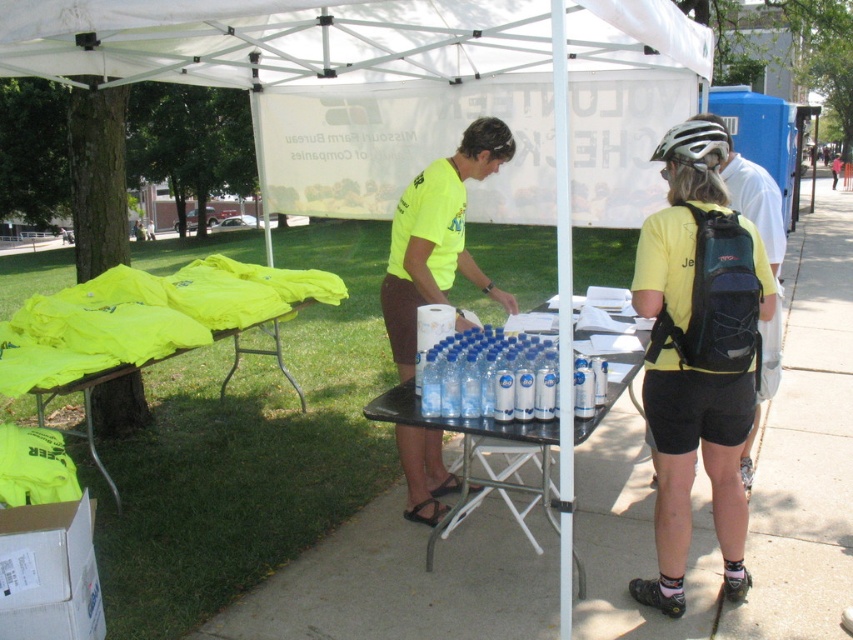
Measure the distance between neon yellow fabric at left and camera.

neon yellow fabric at left and camera are 3.34 meters apart.

Does neon yellow fabric at left appear under clear plastic bottles at center?

Actually, neon yellow fabric at left is above clear plastic bottles at center.

Between point (47, 301) and point (572, 557), which one is positioned in front?

Point (572, 557)

Identify the location of neon yellow fabric at left. (148, 324).

Is yellow matte shirt at center positioned in front of clear plastic bottles at center?

No, yellow matte shirt at center is behind clear plastic bottles at center.

Who is positioned more to the right, yellow matte shirt at center or clear plastic bottles at center?

From the viewer's perspective, yellow matte shirt at center appears more on the right side.

Identify the location of yellow matte shirt at center. The image size is (853, 640). (698, 353).

Between yellow matte shirt at center and white matte bicycle helmet at upper right, which one has more height?

yellow matte shirt at center is taller.

Between yellow matte shirt at center and white matte bicycle helmet at upper right, which one is positioned higher?

white matte bicycle helmet at upper right is above.

The height and width of the screenshot is (640, 853). Identify the location of yellow matte shirt at center. (698, 353).